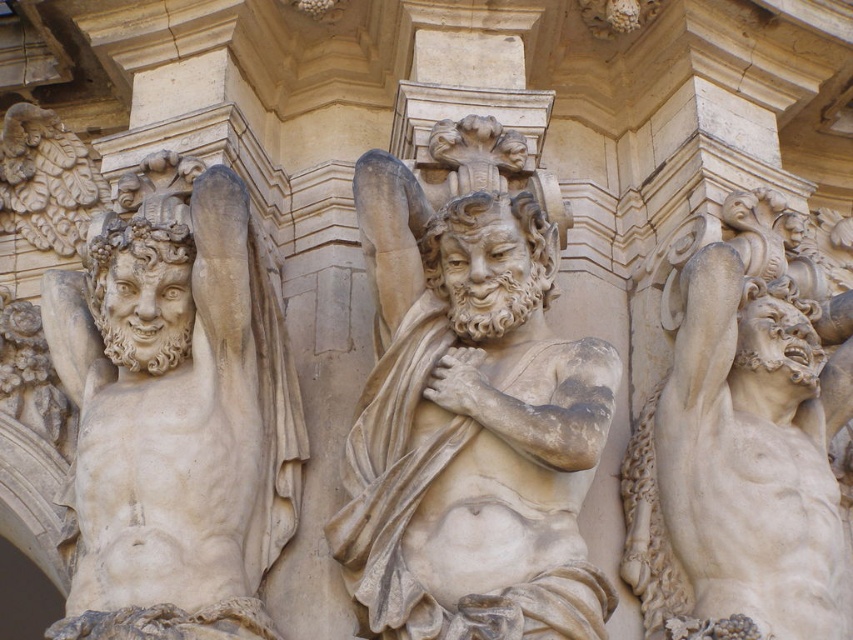
You are an art conservator examining the architectural detail. You need to clean the beige stone figure at center and the matte stone figure at left. Which figure should you start with to avoid disturbing the other?

You should start with the beige stone figure at center because it is in front of the matte stone figure at left, so cleaning it first will prevent dust or debris from settling on the matte stone figure at left behind it.

You are an architect designing a new museum exhibit. You need to place a 60 meter long glass partition between the beige stone figure at center and another similar structure. Based on their current spacing, will the partition fit without overlapping either structure?

The beige stone figure at center and the other structure are 59.63 meters apart. Since the glass partition is 60 meters long, it will not fit as it exceeds the available space by 0.37 meters.

You are an art conservator examining the architectural detail. You need to determine which figure is taller between the beige stone figure at center and the matte stone figure at left. Based on the description, which one is taller?

The beige stone figure at center is taller than the matte stone figure at left.